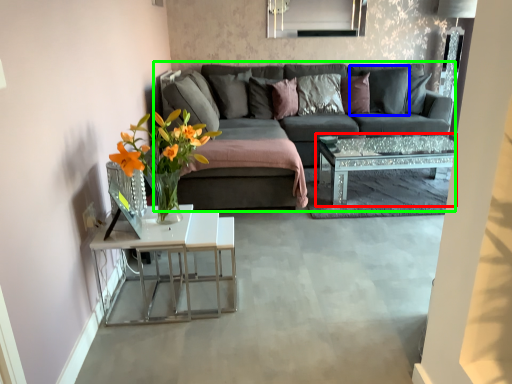
Question: Considering the real-world distances, which object is closest to coffee table (highlighted by a red box)? pillow (highlighted by a blue box) or studio couch (highlighted by a green box).

Choices:
 (A) pillow
 (B) studio couch

Answer: (B)